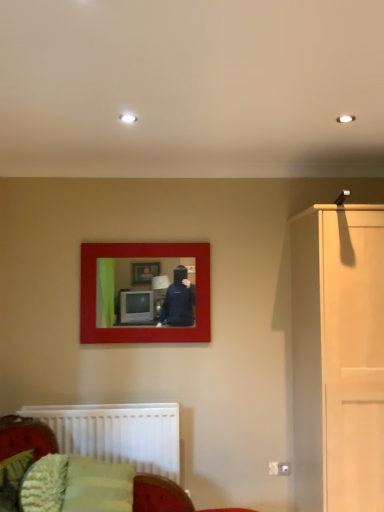
Measure the distance between white matte radiator at lower left and camera.

white matte radiator at lower left is 2.67 meters away from camera.

At what (x,y) coordinates should I click in order to perform the action: click on white matte radiator at lower left. Please return your answer as a coordinate pair (x, y). Image resolution: width=384 pixels, height=512 pixels. Looking at the image, I should click on (117, 433).

What do you see at coordinates (117, 433) in the screenshot?
I see `white matte radiator at lower left` at bounding box center [117, 433].

In order to click on white matte radiator at lower left in this screenshot , I will do `click(117, 433)`.